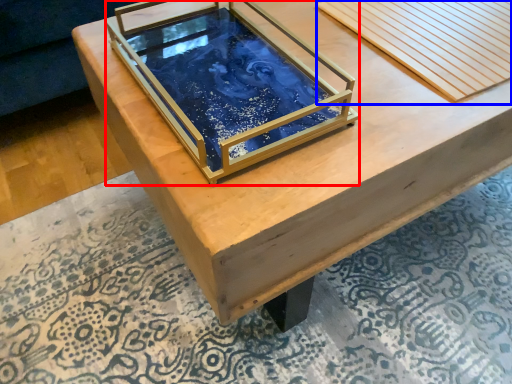
Question: Which object appears farthest to the camera in this image, glass box (highlighted by a red box) or plank (highlighted by a blue box)?

Choices:
 (A) glass box
 (B) plank

Answer: (B)